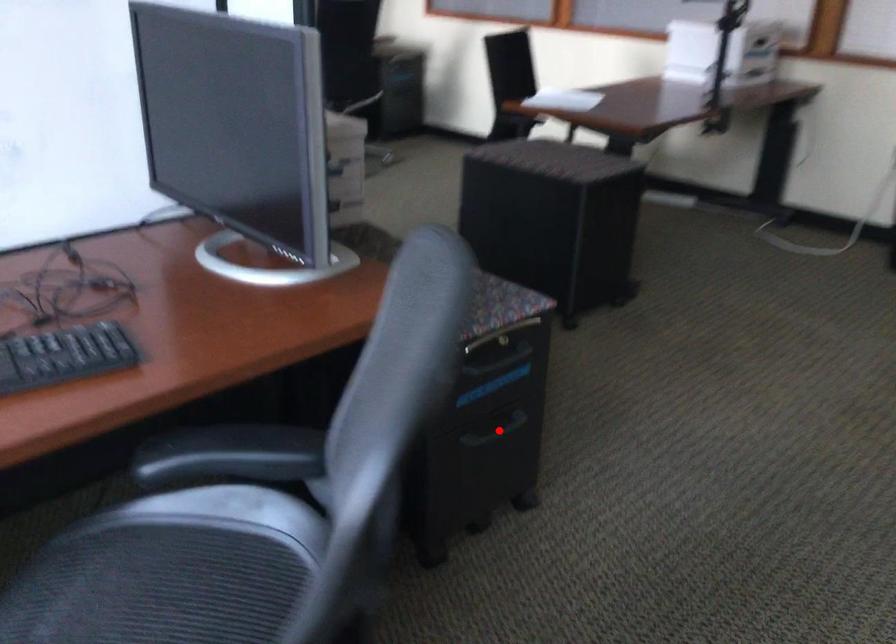
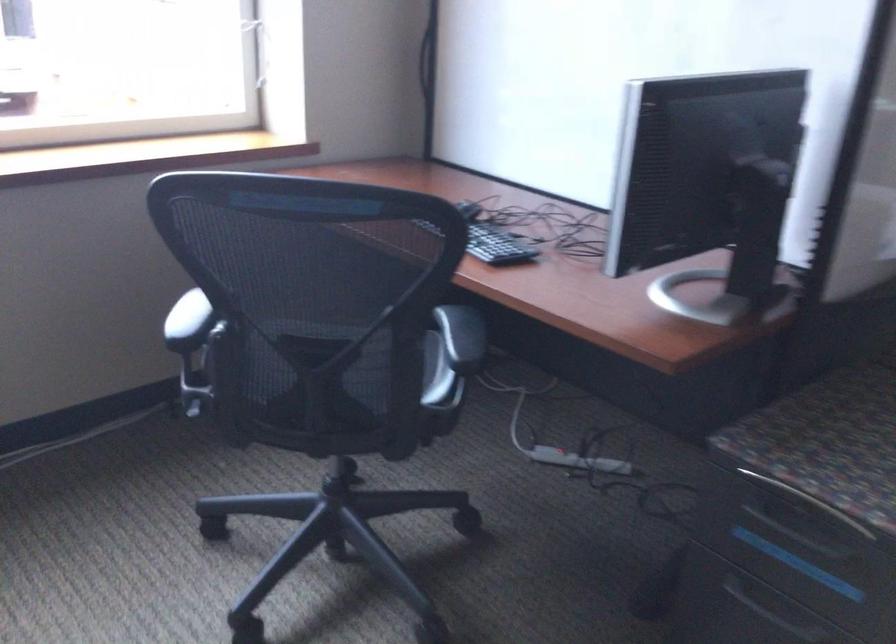
Question: I am providing you with two images of the same scene from different viewpoints. Image1 has a red point marked. In image2, the corresponding 3D location appears at what relative position? Reply with the corresponding letter.

Choices:
 (A) Closer
 (B) Farther

Answer: (A)